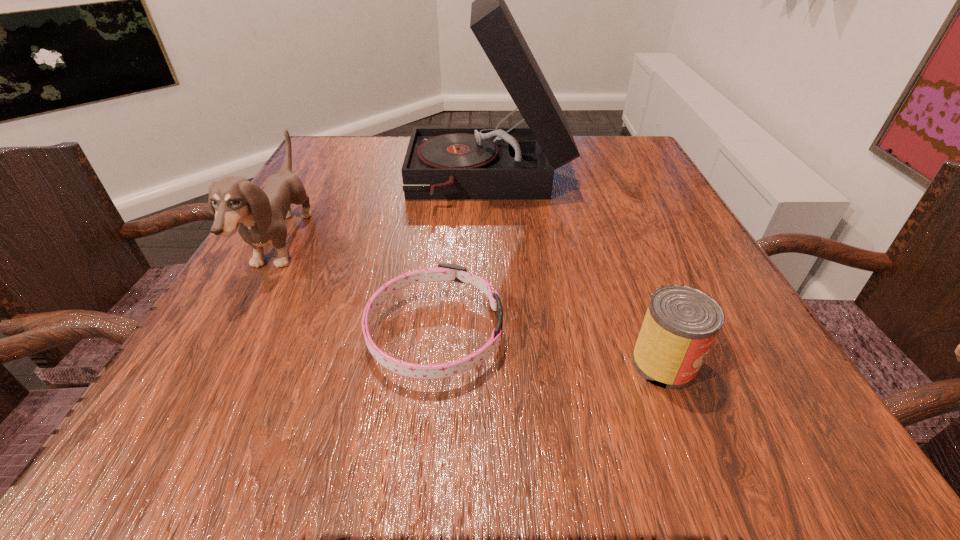
Where is `phonograph_record`? phonograph_record is located at coordinates (513, 163).

Locate an element on the screen. puppy is located at coordinates (258, 215).

Identify the location of the leftmost object. The height and width of the screenshot is (540, 960). (258, 215).

The height and width of the screenshot is (540, 960). Find the location of `the third tallest object`. the third tallest object is located at coordinates (681, 323).

Locate an element on the screen. This screenshot has height=540, width=960. can is located at coordinates (681, 323).

At what (x,y) coordinates should I click in order to perform the action: click on the shortest object. Please return your answer as a coordinate pair (x, y). This screenshot has height=540, width=960. Looking at the image, I should click on (444, 272).

Identify the location of vacant space located on the front-facing side of the tallest object. (306, 181).

Identify the location of free location located 0.230m on the front-facing side of the tallest object. The width and height of the screenshot is (960, 540). (302, 181).

At what (x,y) coordinates should I click in order to perform the action: click on blank space located 0.350m at the face of the leftmost object. Please return your answer as a coordinate pair (x, y). Looking at the image, I should click on (501, 245).

In order to click on free space located 0.160m on the left of the can in this screenshot , I will do `click(512, 363)`.